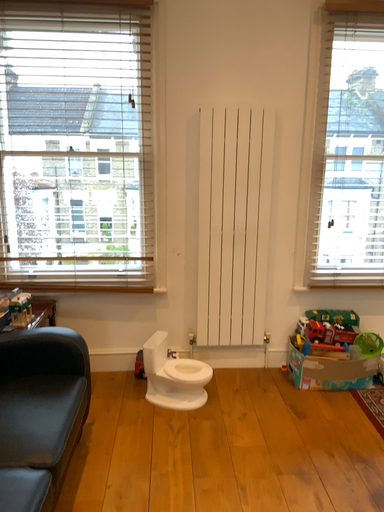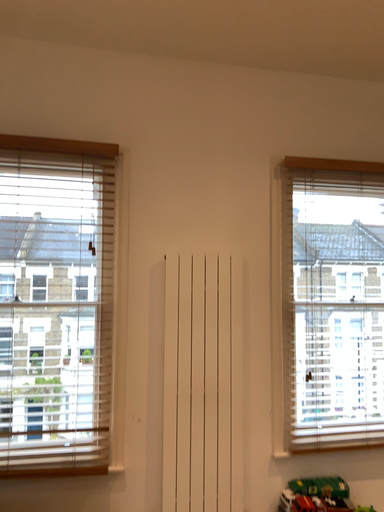
Question: Which way did the camera rotate in the video?

Choices:
 (A) rotated upward
 (B) rotated downward

Answer: (A)